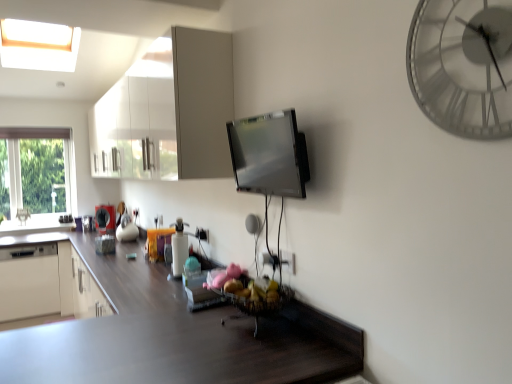
This screenshot has height=384, width=512. Describe the element at coordinates (179, 248) in the screenshot. I see `white glossy bottle at center, the second appliance when ordered from bottom to top` at that location.

Describe the element at coordinates (176, 337) in the screenshot. I see `dark wood countertop at lower center` at that location.

What is the approximate height of satin silver tv at center, placed as the 1th appliance when sorted from top to bottom?

satin silver tv at center, placed as the 1th appliance when sorted from top to bottom, is 16.23 inches tall.

Measure the distance between point (28, 256) and camera.

Point (28, 256) is 4.02 meters from camera.

This screenshot has height=384, width=512. Find the location of `metallic silver clock at upper right`. metallic silver clock at upper right is located at coordinates (463, 66).

From a real-world perspective, is dark wood countertop at lower center positioned above or below metallic silver clock at upper right?

Clearly, from a real-world perspective, dark wood countertop at lower center is below metallic silver clock at upper right.

What are the coordinates of `wall clock positioned vertically above the dark wood countertop at lower center (from a real-world perspective)` in the screenshot? It's located at (463, 66).

Is dark wood countertop at lower center inside the boundaries of metallic silver clock at upper right, or outside?

The correct answer is: outside.

Is dark wood countertop at lower center in contact with metallic silver clock at upper right?

They are not placed beside each other.

Looking at this image, is transparent glass window at left located outside matte black kettle at left, the 3th appliance ordered from the bottom?

Indeed, transparent glass window at left is completely outside matte black kettle at left, the 3th appliance ordered from the bottom.

Is transparent glass window at left looking in the opposite direction of matte black kettle at left, which is the 4th appliance from front to back?

No, matte black kettle at left, which is the 4th appliance from front to back, is not at the back of transparent glass window at left.

From a real-world perspective, is transparent glass window at left under matte black kettle at left, which is the 4th appliance from front to back?

No.

Considering the positions of point (59, 205) and point (98, 226), is point (59, 205) closer or farther from the camera than point (98, 226)?

Point (59, 205) is farther from the camera than point (98, 226).

From the image's perspective, which one is positioned higher, white glossy bottle at center, the 3th appliance when ordered from left to right, or white glossy cabinet at upper center?

white glossy cabinet at upper center.

Which object is further away from the camera, white glossy bottle at center, which appears as the 3th appliance when viewed from the top, or white glossy cabinet at upper center?

white glossy bottle at center, which appears as the 3th appliance when viewed from the top.

Does point (187, 237) come behind point (142, 63)?

No, it is in front of (142, 63).

Who is shorter, white glossy bottle at center, placed as the third appliance when sorted from back to front, or white glossy cabinet at upper center?

Standing shorter between the two is white glossy bottle at center, placed as the third appliance when sorted from back to front.

Is transparent glass window at left not within white glossy bottle at center, which ranks as the 2th appliance in front-to-back order?

That's correct, transparent glass window at left is outside of white glossy bottle at center, which ranks as the 2th appliance in front-to-back order.

Can you confirm if transparent glass window at left is thinner than white glossy bottle at center, which appears as the 3th appliance when viewed from the top?

Indeed, transparent glass window at left has a lesser width compared to white glossy bottle at center, which appears as the 3th appliance when viewed from the top.

Does transparent glass window at left have a greater height compared to white glossy bottle at center, positioned as the second appliance in right-to-left order?

Yes, transparent glass window at left is taller than white glossy bottle at center, positioned as the second appliance in right-to-left order.

Find the location of `window behind the white glossy bottle at center, placed as the third appliance when sorted from back to front`. window behind the white glossy bottle at center, placed as the third appliance when sorted from back to front is located at coordinates pos(36,177).

What's the angular difference between white glossy dishwasher at lower left, which appears as the 4th appliance when viewed from the top, and matte black kettle at left, the 2th appliance from the top,'s facing directions?

white glossy dishwasher at lower left, which appears as the 4th appliance when viewed from the top, and matte black kettle at left, the 2th appliance from the top, are facing 53.6 degrees away from each other.

From the image's perspective, between white glossy dishwasher at lower left, positioned as the fourth appliance in right-to-left order, and matte black kettle at left, the 2th appliance from the top, which one is located above?

matte black kettle at left, the 2th appliance from the top, is shown above in the image.

Who is smaller, white glossy dishwasher at lower left, the first appliance positioned from the left, or matte black kettle at left, which is counted as the first appliance, starting from the back?

matte black kettle at left, which is counted as the first appliance, starting from the back.

How distant is white glossy dishwasher at lower left, positioned as the fourth appliance in right-to-left order, from matte black kettle at left, the 2th appliance from the top?

A distance of 32.11 inches exists between white glossy dishwasher at lower left, positioned as the fourth appliance in right-to-left order, and matte black kettle at left, the 2th appliance from the top.

Which object is more forward, white glossy cabinet at upper center or white glossy bottle at center, the second appliance when ordered from bottom to top?

white glossy cabinet at upper center is in front.

Can you confirm if white glossy cabinet at upper center is bigger than white glossy bottle at center, which appears as the 3th appliance when viewed from the top?

Yes, white glossy cabinet at upper center is bigger than white glossy bottle at center, which appears as the 3th appliance when viewed from the top.

Considering the relative sizes of white glossy cabinet at upper center and white glossy bottle at center, which ranks as the 2th appliance in front-to-back order, in the image provided, is white glossy cabinet at upper center taller than white glossy bottle at center, which ranks as the 2th appliance in front-to-back order,?

Correct, white glossy cabinet at upper center is much taller as white glossy bottle at center, which ranks as the 2th appliance in front-to-back order.

Is white glossy cabinet at upper center not within white glossy bottle at center, placed as the third appliance when sorted from back to front?

Yes, white glossy cabinet at upper center is not within white glossy bottle at center, placed as the third appliance when sorted from back to front.

Can you confirm if satin silver tv at center, the first appliance positioned from the right, is positioned to the right of metallic silver clock at upper right?

No, satin silver tv at center, the first appliance positioned from the right, is not to the right of metallic silver clock at upper right.

Is satin silver tv at center, the 4th appliance viewed from the back, aimed at metallic silver clock at upper right?

No, satin silver tv at center, the 4th appliance viewed from the back, does not turn towards metallic silver clock at upper right.

Which is in front, point (294, 177) or point (480, 21)?

The point (480, 21) is more forward.

Is satin silver tv at center, the 4th appliance viewed from the back, taller or shorter than metallic silver clock at upper right?

satin silver tv at center, the 4th appliance viewed from the back, is taller than metallic silver clock at upper right.

This screenshot has height=384, width=512. I want to click on wall clock that appears above the dark wood countertop at lower center (from the image's perspective), so click(x=463, y=66).

Locate an element on the screen. This screenshot has width=512, height=384. window that is on the left side of matte black kettle at left, the 2th appliance from the top is located at coordinates (36, 177).

Looking at this image, based on their spatial positions, is white glossy bottle at center, the second appliance when ordered from bottom to top, or metallic silver clock at upper right closer to matte black kettle at left, the 3th appliance ordered from the bottom?

white glossy bottle at center, the second appliance when ordered from bottom to top, is positioned closer to the anchor matte black kettle at left, the 3th appliance ordered from the bottom.

In the scene shown: Based on their spatial positions, is metallic silver clock at upper right or white glossy bottle at center, positioned as the second appliance in right-to-left order, closer to dark wood countertop at lower center?

white glossy bottle at center, positioned as the second appliance in right-to-left order.

Based on their spatial positions, is matte black kettle at left, placed as the 3th appliance when sorted from right to left, or dark wood countertop at lower center closer to white glossy cabinet at upper center?

dark wood countertop at lower center is closer to white glossy cabinet at upper center.

In the scene shown: Estimate the real-world distances between objects in this image. Which object is closer to metallic silver clock at upper right, white glossy cabinet at upper center or satin silver tv at center, the 4th appliance viewed from the back?

satin silver tv at center, the 4th appliance viewed from the back.

When comparing their distances from transparent glass window at left, does dark wood countertop at lower center or white glossy bottle at center, positioned as the second appliance in right-to-left order, seem closer?

The object closer to transparent glass window at left is dark wood countertop at lower center.

From the image, which object appears to be nearer to white glossy dishwasher at lower left, positioned as the 2th appliance in back-to-front order, matte black kettle at left, placed as the 3th appliance when sorted from right to left, or dark wood countertop at lower center?

matte black kettle at left, placed as the 3th appliance when sorted from right to left, is positioned closer to the anchor white glossy dishwasher at lower left, positioned as the 2th appliance in back-to-front order.

From the image, which object appears to be nearer to matte black kettle at left, which is counted as the first appliance, starting from the back, dark wood countertop at lower center or satin silver tv at center, placed as the 1th appliance when sorted from top to bottom?

dark wood countertop at lower center is positioned closer to the anchor matte black kettle at left, which is counted as the first appliance, starting from the back.

From the image, which object appears to be nearer to white glossy cabinet at upper center, transparent glass window at left or white glossy dishwasher at lower left, acting as the 1th appliance starting from the bottom?

→ white glossy dishwasher at lower left, acting as the 1th appliance starting from the bottom, is closer to white glossy cabinet at upper center.

Identify the location of countertop located between metallic silver clock at upper right and transparent glass window at left in the depth direction. (176, 337).

Where is `appliance between white glossy cabinet at upper center and white glossy dishwasher at lower left, arranged as the 3th appliance when viewed from the front, in the front-back direction`? Image resolution: width=512 pixels, height=384 pixels. appliance between white glossy cabinet at upper center and white glossy dishwasher at lower left, arranged as the 3th appliance when viewed from the front, in the front-back direction is located at coordinates click(x=179, y=248).

Locate an element on the screen. cabinetry between metallic silver clock at upper right and transparent glass window at left from front to back is located at coordinates (168, 112).

Locate an element on the screen. The image size is (512, 384). cabinetry between satin silver tv at center, the first appliance positioned from the right, and white glossy dishwasher at lower left, positioned as the 2th appliance in back-to-front order, from front to back is located at coordinates (168, 112).